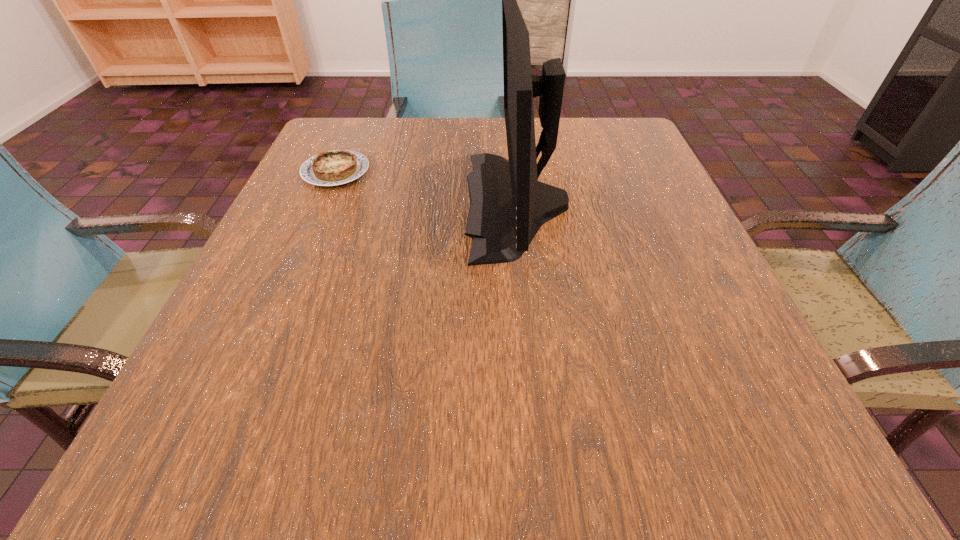
Where is `monitor`? The image size is (960, 540). monitor is located at coordinates (508, 205).

Where is `the right object`? The image size is (960, 540). the right object is located at coordinates (508, 205).

Locate an element on the screen. quiche is located at coordinates (330, 168).

You are a GUI agent. You are given a task and a screenshot of the screen. Output one action in this format:
    pyautogui.click(x=<x>, y=<y>)
    Task: Click on the left object
    This screenshot has height=540, width=960.
    Given the screenshot: What is the action you would take?
    click(x=330, y=168)

Where is `vacant area situated on the screen side of the taller object`? vacant area situated on the screen side of the taller object is located at coordinates (372, 204).

Image resolution: width=960 pixels, height=540 pixels. Find the location of `vacant space located 0.250m on the screen side of the taller object`. vacant space located 0.250m on the screen side of the taller object is located at coordinates (335, 204).

The width and height of the screenshot is (960, 540). I want to click on free space located on the screen side of the taller object, so tap(403, 204).

This screenshot has width=960, height=540. In order to click on free space located 0.360m on the front of the left object in this screenshot , I will do `click(265, 336)`.

Where is `monitor present at the far edge`? monitor present at the far edge is located at coordinates (508, 205).

Find the location of a particular element. quiche at the far edge is located at coordinates (330, 168).